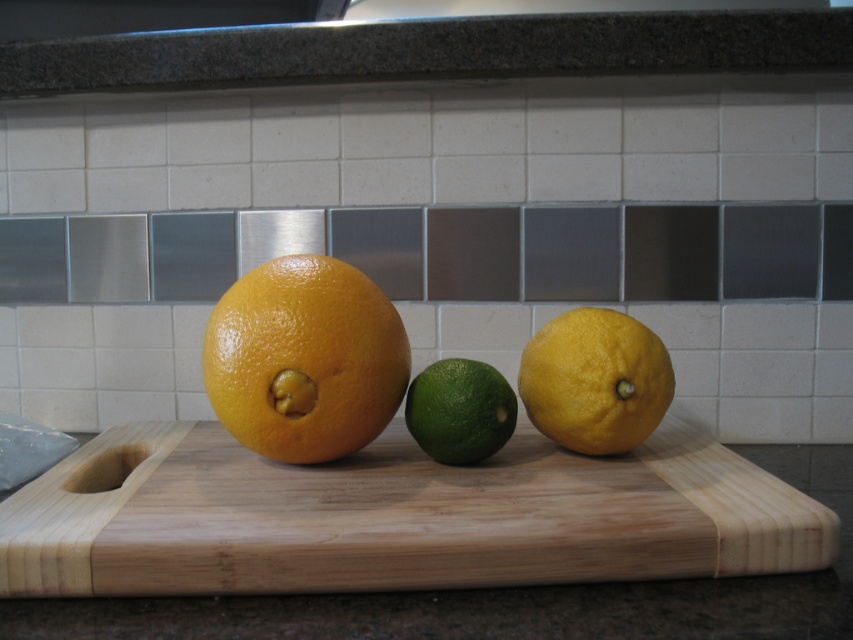
Question: Which is nearer to the green matte/lacquered lime at center?

Choices:
 (A) orange matte/grainy grapefruit at center
 (B) yellow matte lemon at center

Answer: (B)

Question: Considering the real-world distances, which object is farthest from the yellow matte lemon at center?

Choices:
 (A) green matte/lacquered lime at center
 (B) orange matte/grainy grapefruit at center
 (C) wooden cutting board at center

Answer: (C)

Question: Is wooden cutting board at center wider than orange matte/grainy grapefruit at center?

Choices:
 (A) no
 (B) yes

Answer: (B)

Question: Can you confirm if orange matte/grainy grapefruit at center is positioned to the right of green matte/lacquered lime at center?

Choices:
 (A) no
 (B) yes

Answer: (A)

Question: Is wooden cutting board at center below orange matte/grainy grapefruit at center?

Choices:
 (A) yes
 (B) no

Answer: (A)

Question: Which object appears closest to the camera in this image?

Choices:
 (A) green matte/lacquered lime at center
 (B) wooden cutting board at center
 (C) yellow matte lemon at center
 (D) orange matte/grainy grapefruit at center

Answer: (B)